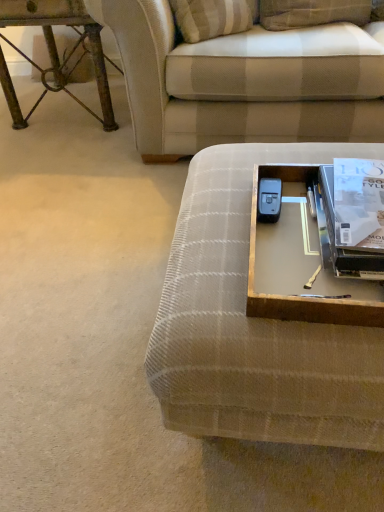
Locate an element on the screen. The image size is (384, 512). rusty metal table at upper left is located at coordinates (56, 52).

Describe the element at coordinates (301, 266) in the screenshot. I see `metallic silver tray at lower right` at that location.

This screenshot has height=512, width=384. Describe the element at coordinates (254, 325) in the screenshot. I see `plaid fabric studio couch at center, placed as the second studio couch when sorted from back to front` at that location.

Identify the location of rusty metal table at upper left. (56, 52).

Which is behind, metallic silver tray at lower right or plaid fabric couch at upper center, which is counted as the second studio couch, starting from the bottom?

plaid fabric couch at upper center, which is counted as the second studio couch, starting from the bottom, is behind.

Is point (307, 312) closer or farther from the camera than point (105, 8)?

Clearly, point (307, 312) is closer to the camera than point (105, 8).

Image resolution: width=384 pixels, height=512 pixels. Find the location of `round table to the left of plaid fabric couch at upper center, which is counted as the first studio couch, starting from the top`. round table to the left of plaid fabric couch at upper center, which is counted as the first studio couch, starting from the top is located at coordinates (301, 266).

Does metallic silver tray at lower right have a greater width compared to plaid fabric couch at upper center, acting as the second studio couch starting from the front?

No.

Is plaid fabric studio couch at center, the 1th studio couch when ordered from front to back, taller than metallic silver tray at lower right?

Yes.

Does point (194, 306) appear closer or farther from the camera than point (323, 288)?

Clearly, point (194, 306) is closer to the camera than point (323, 288).

Is metallic silver tray at lower right inside plaid fabric studio couch at center, the second studio couch in the top-to-bottom sequence?

No, metallic silver tray at lower right is not surrounded by plaid fabric studio couch at center, the second studio couch in the top-to-bottom sequence.

Is point (327, 36) closer or farther from the camera than point (378, 411)?

Point (327, 36).

In order to click on studio couch below the plaid fabric couch at upper center, which ranks as the 1th studio couch in back-to-front order (from a real-world perspective) in this screenshot , I will do click(254, 325).

Considering the sizes of objects plaid fabric couch at upper center, which ranks as the 1th studio couch in back-to-front order, and plaid fabric studio couch at center, placed as the second studio couch when sorted from back to front, in the image provided, who is smaller, plaid fabric couch at upper center, which ranks as the 1th studio couch in back-to-front order, or plaid fabric studio couch at center, placed as the second studio couch when sorted from back to front,?

With smaller size is plaid fabric studio couch at center, placed as the second studio couch when sorted from back to front.

From the image's perspective, which is below, plaid fabric couch at upper center, which ranks as the 1th studio couch in back-to-front order, or plaid fabric studio couch at center, placed as the first studio couch when sorted from bottom to top?

plaid fabric studio couch at center, placed as the first studio couch when sorted from bottom to top, appears lower in the image.

Does plaid fabric couch at upper center, acting as the second studio couch starting from the front, have a lesser width compared to metallic silver tray at lower right?

No, plaid fabric couch at upper center, acting as the second studio couch starting from the front, is not thinner than metallic silver tray at lower right.

Looking at this image, considering the sizes of plaid fabric couch at upper center, which is counted as the second studio couch, starting from the bottom, and metallic silver tray at lower right in the image, is plaid fabric couch at upper center, which is counted as the second studio couch, starting from the bottom, taller or shorter than metallic silver tray at lower right?

Considering their sizes, plaid fabric couch at upper center, which is counted as the second studio couch, starting from the bottom, has more height than metallic silver tray at lower right.

Between plaid fabric couch at upper center, which ranks as the 1th studio couch in back-to-front order, and metallic silver tray at lower right, which one appears on the right side from the viewer's perspective?

From the viewer's perspective, plaid fabric couch at upper center, which ranks as the 1th studio couch in back-to-front order, appears more on the right side.

Is plaid fabric couch at upper center, which is counted as the second studio couch, starting from the bottom, far away from metallic silver tray at lower right?

No, plaid fabric couch at upper center, which is counted as the second studio couch, starting from the bottom, is not far from metallic silver tray at lower right.

Is rusty metal table at upper left behind plaid fabric studio couch at center, placed as the second studio couch when sorted from back to front?

That is True.

Does rusty metal table at upper left appear on the right side of plaid fabric studio couch at center, the 1th studio couch when ordered from front to back?

No, rusty metal table at upper left is not to the right of plaid fabric studio couch at center, the 1th studio couch when ordered from front to back.

Between rusty metal table at upper left and plaid fabric studio couch at center, placed as the first studio couch when sorted from bottom to top, which one has less height?

Standing shorter between the two is plaid fabric studio couch at center, placed as the first studio couch when sorted from bottom to top.

The width and height of the screenshot is (384, 512). I want to click on table on the left of the plaid fabric couch at upper center, acting as the second studio couch starting from the front, so click(x=56, y=52).

Is rusty metal table at upper left positioned with its back to plaid fabric couch at upper center, which is counted as the first studio couch, starting from the top?

No, plaid fabric couch at upper center, which is counted as the first studio couch, starting from the top, is not at the back of rusty metal table at upper left.

Which is correct: rusty metal table at upper left is inside plaid fabric couch at upper center, which is counted as the second studio couch, starting from the bottom, or outside of it?

rusty metal table at upper left is outside plaid fabric couch at upper center, which is counted as the second studio couch, starting from the bottom.

What's the angular difference between rusty metal table at upper left and plaid fabric couch at upper center, acting as the second studio couch starting from the front,'s facing directions?

The angular difference between rusty metal table at upper left and plaid fabric couch at upper center, acting as the second studio couch starting from the front, is 1.97 degrees.

Who is shorter, metallic silver tray at lower right or rusty metal table at upper left?

Standing shorter between the two is metallic silver tray at lower right.

Would you say metallic silver tray at lower right is outside rusty metal table at upper left?

Absolutely, metallic silver tray at lower right is external to rusty metal table at upper left.

Between metallic silver tray at lower right and rusty metal table at upper left, which one has smaller size?

Smaller between the two is metallic silver tray at lower right.

In terms of width, does metallic silver tray at lower right look wider or thinner when compared to rusty metal table at upper left?

Considering their sizes, metallic silver tray at lower right looks slimmer than rusty metal table at upper left.

Find the location of a particular element. This screenshot has height=512, width=384. round table in front of the plaid fabric couch at upper center, which is counted as the second studio couch, starting from the bottom is located at coordinates (301, 266).

In order to click on round table above the plaid fabric studio couch at center, the second studio couch in the top-to-bottom sequence (from the image's perspective) in this screenshot , I will do `click(301, 266)`.

In the scene shown: Estimate the real-world distances between objects in this image. Which object is further from rusty metal table at upper left, plaid fabric couch at upper center, which is counted as the second studio couch, starting from the bottom, or plaid fabric studio couch at center, placed as the second studio couch when sorted from back to front?

plaid fabric studio couch at center, placed as the second studio couch when sorted from back to front, is further to rusty metal table at upper left.

Looking at the image, which one is located closer to rusty metal table at upper left, plaid fabric studio couch at center, the second studio couch in the top-to-bottom sequence, or metallic silver tray at lower right?

plaid fabric studio couch at center, the second studio couch in the top-to-bottom sequence.

Which object lies further to the anchor point plaid fabric couch at upper center, which ranks as the 1th studio couch in back-to-front order, metallic silver tray at lower right or rusty metal table at upper left?

metallic silver tray at lower right is further to plaid fabric couch at upper center, which ranks as the 1th studio couch in back-to-front order.

Estimate the real-world distances between objects in this image. Which object is further from plaid fabric couch at upper center, which is counted as the second studio couch, starting from the bottom, rusty metal table at upper left or plaid fabric studio couch at center, placed as the second studio couch when sorted from back to front?

Among the two, plaid fabric studio couch at center, placed as the second studio couch when sorted from back to front, is located further to plaid fabric couch at upper center, which is counted as the second studio couch, starting from the bottom.

Estimate the real-world distances between objects in this image. Which object is further from plaid fabric couch at upper center, which is counted as the first studio couch, starting from the top, metallic silver tray at lower right or plaid fabric studio couch at center, placed as the first studio couch when sorted from bottom to top?

The object further to plaid fabric couch at upper center, which is counted as the first studio couch, starting from the top, is metallic silver tray at lower right.

Considering their positions, is metallic silver tray at lower right positioned further to plaid fabric studio couch at center, placed as the second studio couch when sorted from back to front, than plaid fabric couch at upper center, which ranks as the 1th studio couch in back-to-front order?

Based on the image, plaid fabric couch at upper center, which ranks as the 1th studio couch in back-to-front order, appears to be further to plaid fabric studio couch at center, placed as the second studio couch when sorted from back to front.

Based on their spatial positions, is plaid fabric couch at upper center, which ranks as the 1th studio couch in back-to-front order, or plaid fabric studio couch at center, placed as the second studio couch when sorted from back to front, further from metallic silver tray at lower right?

The object further to metallic silver tray at lower right is plaid fabric couch at upper center, which ranks as the 1th studio couch in back-to-front order.

In the scene shown: Estimate the real-world distances between objects in this image. Which object is closer to plaid fabric couch at upper center, which is counted as the second studio couch, starting from the bottom, plaid fabric studio couch at center, placed as the first studio couch when sorted from bottom to top, or rusty metal table at upper left?

Based on the image, rusty metal table at upper left appears to be nearer to plaid fabric couch at upper center, which is counted as the second studio couch, starting from the bottom.

Where is `round table between plaid fabric couch at upper center, acting as the second studio couch starting from the front, and plaid fabric studio couch at center, the 1th studio couch when ordered from front to back, in the vertical direction`? round table between plaid fabric couch at upper center, acting as the second studio couch starting from the front, and plaid fabric studio couch at center, the 1th studio couch when ordered from front to back, in the vertical direction is located at coordinates (301, 266).

You are a GUI agent. You are given a task and a screenshot of the screen. Output one action in this format:
    pyautogui.click(x=<x>, y=<y>)
    Task: Click on the studio couch that lies between rusty metal table at upper left and plaid fabric studio couch at center, the 1th studio couch when ordered from front to back, from top to bottom
    This screenshot has width=384, height=512.
    Given the screenshot: What is the action you would take?
    pyautogui.click(x=244, y=82)

Locate an element on the screen. The width and height of the screenshot is (384, 512). studio couch that lies between rusty metal table at upper left and metallic silver tray at lower right from top to bottom is located at coordinates (244, 82).

Where is `round table positioned between plaid fabric studio couch at center, placed as the first studio couch when sorted from bottom to top, and rusty metal table at upper left from near to far`? The image size is (384, 512). round table positioned between plaid fabric studio couch at center, placed as the first studio couch when sorted from bottom to top, and rusty metal table at upper left from near to far is located at coordinates (301, 266).